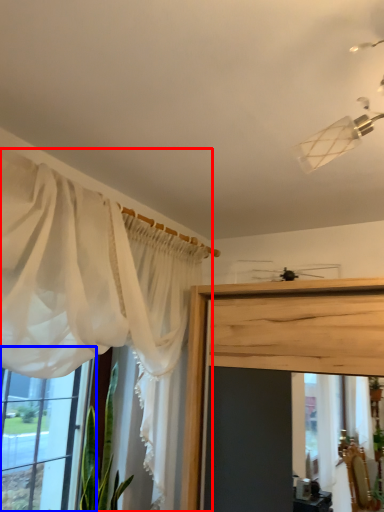
Question: Among these objects, which one is nearest to the camera, curtain (highlighted by a red box) or window (highlighted by a blue box)?

Choices:
 (A) curtain
 (B) window

Answer: (A)